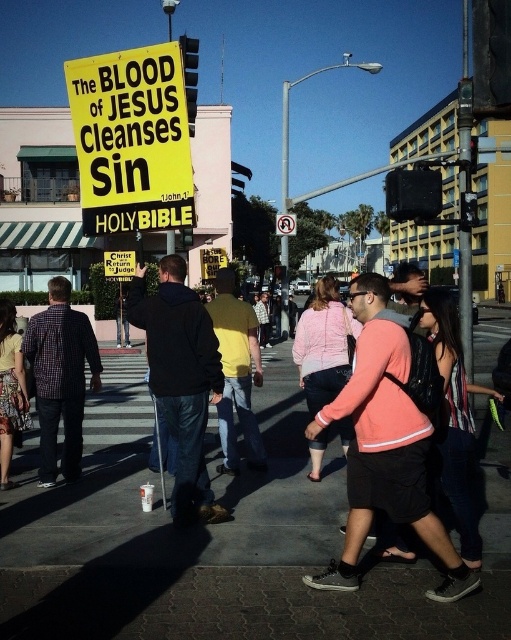
What is the 2D coordinate of the gray concrete sidewalk at center?

The gray concrete sidewalk at center is located at the 2D coordinate point of (222, 548).

You are a city planner analyzing the urban layout. Given the gray concrete sidewalk at center and the yellow paper sign at upper left, which one is narrower in width?

The gray concrete sidewalk at center has a lesser width compared to the yellow paper sign at upper left, so the sidewalk is narrower.

You are a delivery person trying to navigate through the urban street scene. You see the gray concrete sidewalk at center and the yellow paper sign at upper left. Which object is positioned lower in the image?

The gray concrete sidewalk at center is located below the yellow paper sign at upper left, so the gray concrete sidewalk at center is positioned lower in the image.